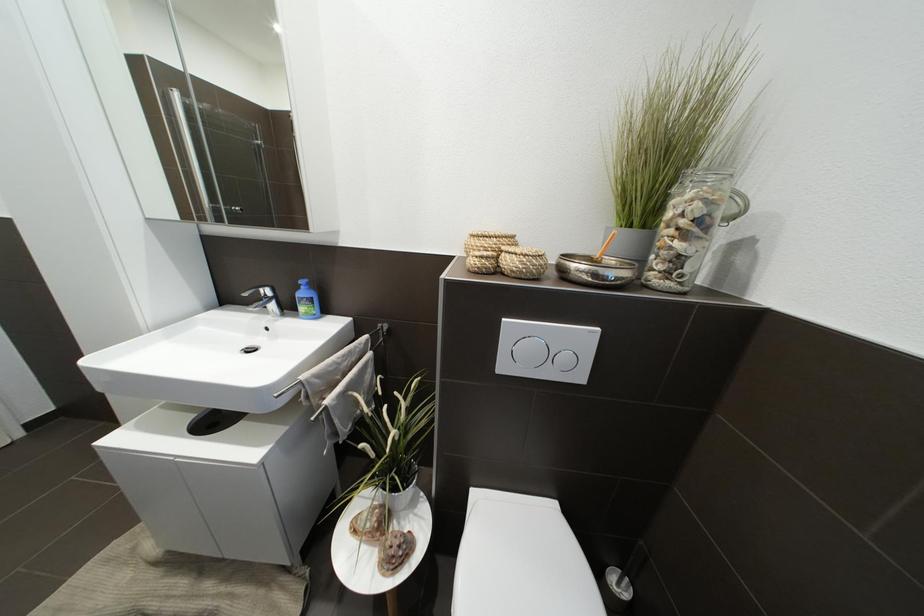
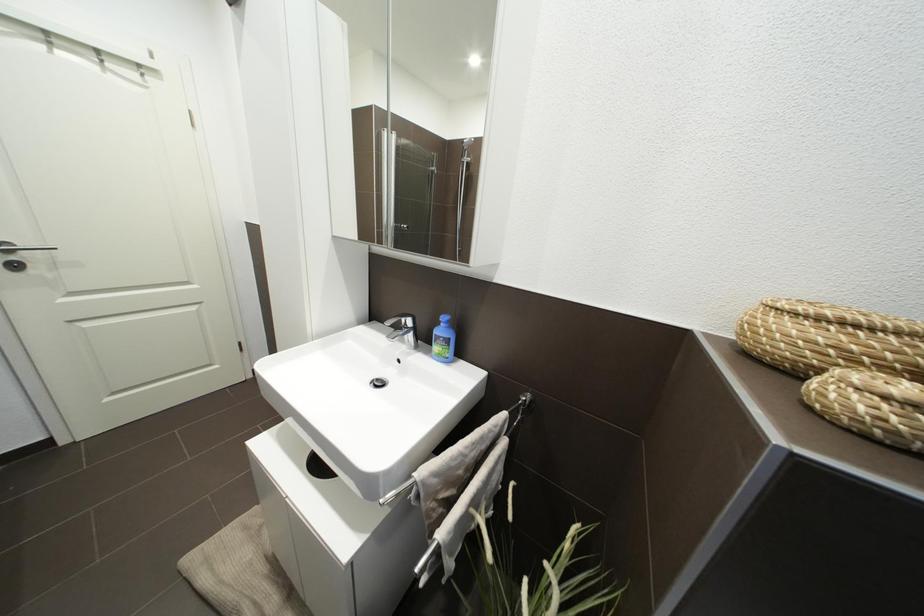
Question: The camera is either moving clockwise (left) or counter-clockwise (right) around the object. The first image is from the beginning of the video and the second image is from the end. Is the camera moving left or right when shooting the video?

Choices:
 (A) Left
 (B) Right

Answer: (B)